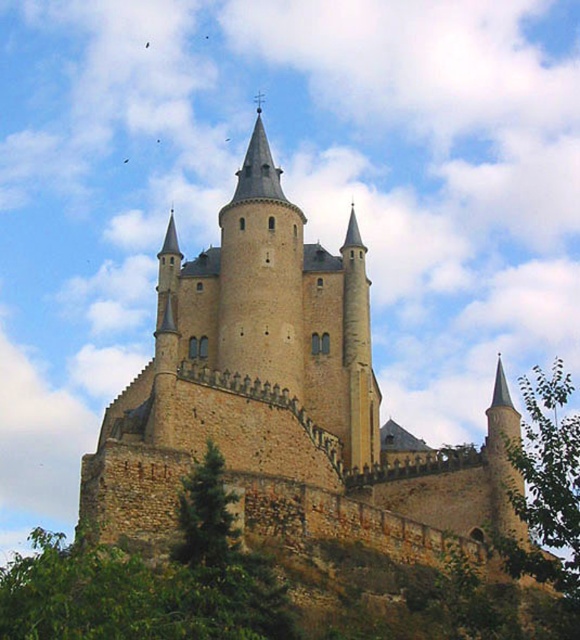
Who is more distant from viewer, (245, 260) or (568, 440)?

The point (245, 260) is behind.

The image size is (580, 640). What do you see at coordinates (288, 394) in the screenshot?
I see `beige stone castle at center` at bounding box center [288, 394].

Locate an element on the screen. This screenshot has height=640, width=580. beige stone castle at center is located at coordinates (288, 394).